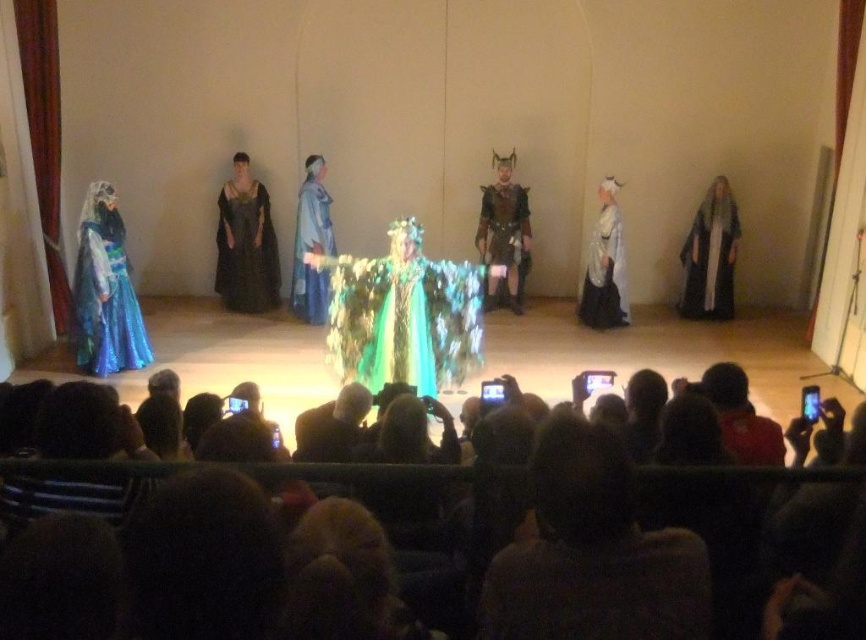
Looking at this image, you are sitting in the audience watching the performance. There are two points marked on the stage at coordinates point (461,472) and point (230,195). Which point is closer to you?

Point (461,472) is closer to the viewer than point (230,195).